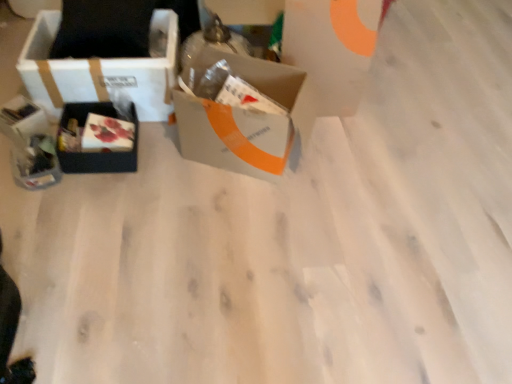
Image resolution: width=512 pixels, height=384 pixels. I want to click on vacant area that lies to the right of gray cardboard box at center, which is counted as the 3th box, starting from the left, so [x=346, y=164].